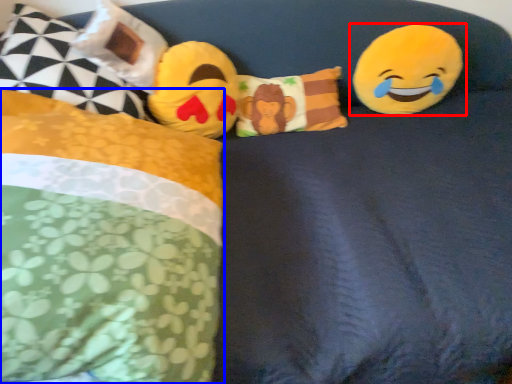
Question: Which object appears closest to the camera in this image, toy (highlighted by a red box) or pillow (highlighted by a blue box)?

Choices:
 (A) toy
 (B) pillow

Answer: (B)